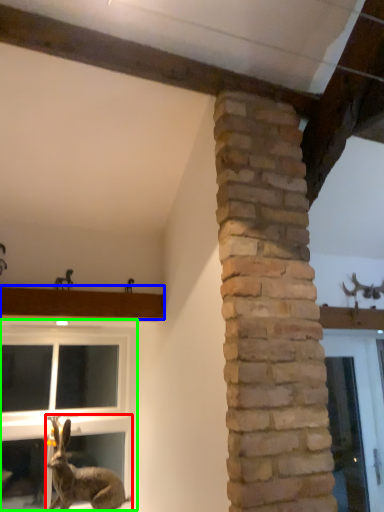
Question: Considering the real-world distances, which object is closest to rabbit (highlighted by a red box)? window sill (highlighted by a blue box) or window (highlighted by a green box).

Choices:
 (A) window sill
 (B) window

Answer: (B)